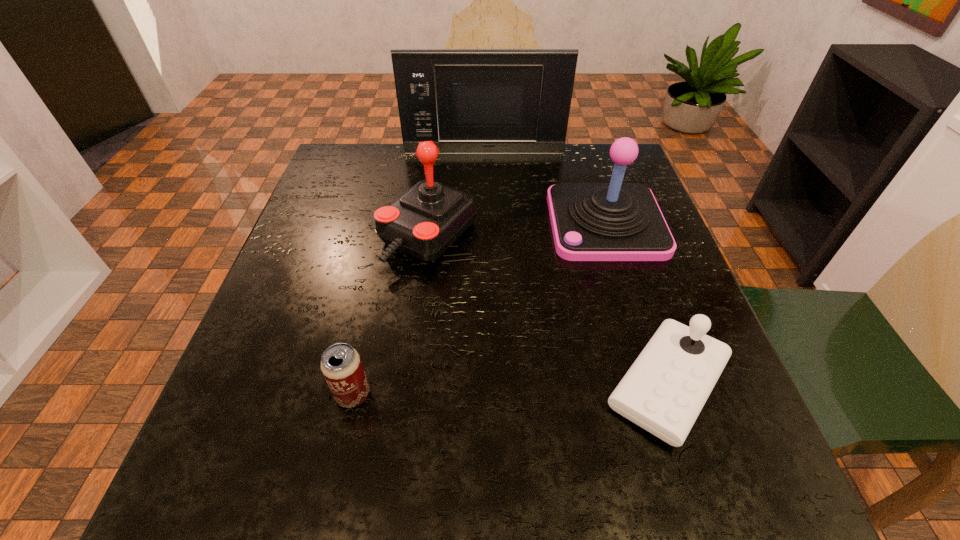
At what (x,y) coordinates should I click in order to perform the action: click on joystick positioned at the far edge. Please return your answer as a coordinate pair (x, y). This screenshot has height=540, width=960. Looking at the image, I should click on (615, 221).

Where is `object located at the near edge`? object located at the near edge is located at coordinates pyautogui.click(x=665, y=389).

Find the location of a particular element. The height and width of the screenshot is (540, 960). object that is positioned at the far right corner is located at coordinates (615, 221).

You are a GUI agent. You are given a task and a screenshot of the screen. Output one action in this format:
    pyautogui.click(x=<x>, y=<y>)
    Task: Click on the object located in the near right corner section of the desktop
    The image size is (960, 540).
    Given the screenshot: What is the action you would take?
    pyautogui.click(x=665, y=389)

In order to click on free space at the far edge of the desktop in this screenshot , I will do `click(549, 175)`.

At what (x,y) coordinates should I click in order to perform the action: click on vacant space at the near edge of the desktop. Please return your answer as a coordinate pair (x, y). The width and height of the screenshot is (960, 540). Looking at the image, I should click on (627, 488).

Locate an element on the screen. This screenshot has height=540, width=960. blank space at the left edge of the desktop is located at coordinates (338, 242).

I want to click on vacant space at the right edge of the desktop, so click(x=661, y=272).

Identify the location of vacant region at the near left corner of the desktop. This screenshot has height=540, width=960. (282, 505).

Find the location of a particular element. This screenshot has height=540, width=960. vacant space at the far right corner of the desktop is located at coordinates (601, 147).